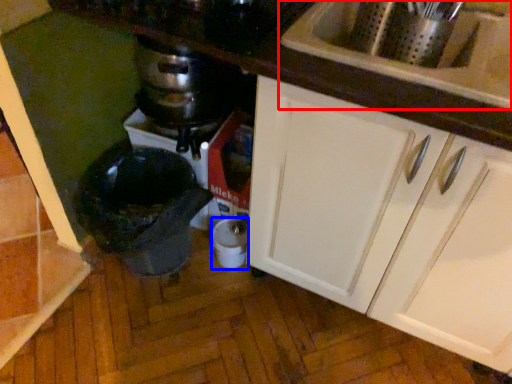
Question: Among these objects, which one is farthest to the camera, sink (highlighted by a red box) or appliance (highlighted by a blue box)?

Choices:
 (A) sink
 (B) appliance

Answer: (B)